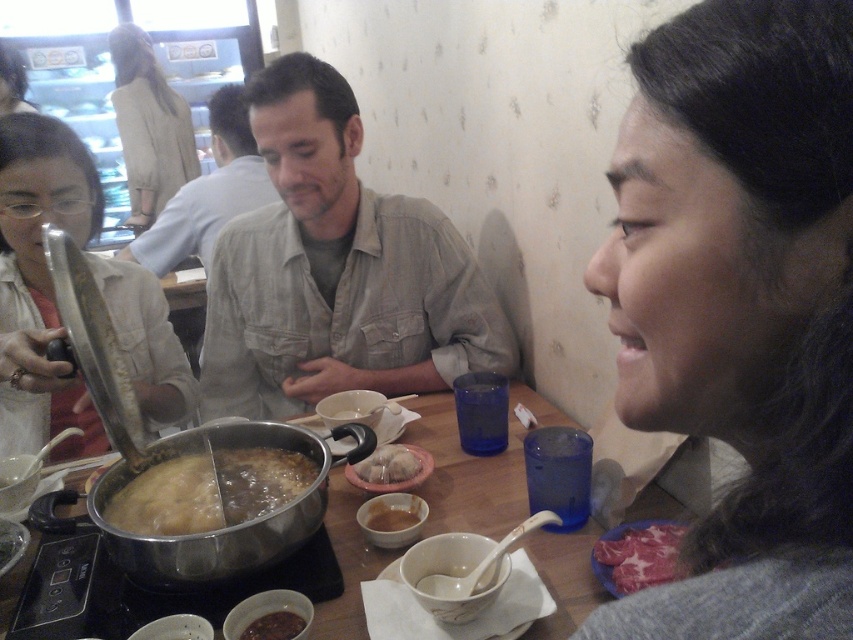
You are a server in a restaurant and need to deliver a drink to the table where the translucent glass soup at center is located. The drink must be placed exactly 36 inches away from the soup to avoid spills. Can you place the drink at the required distance?

The translucent glass soup at center and camera are 36.58 inches apart. Since the required distance is 36 inches, the drink can be placed slightly closer to the soup than the current camera position to meet the requirement.

You are a customer at the restaurant and want to order a drink. The server mentions there is a soup located at the center of the table. Can you confirm if the translucent glass soup at center is exactly at the center of the table?

The translucent glass soup at center is located at point (207,490), which is not exactly at the center of the table.